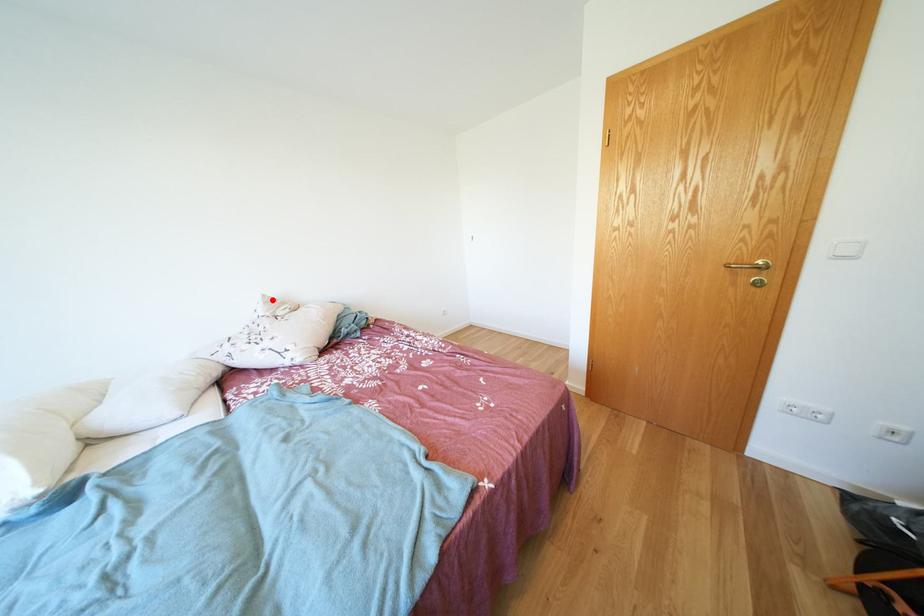
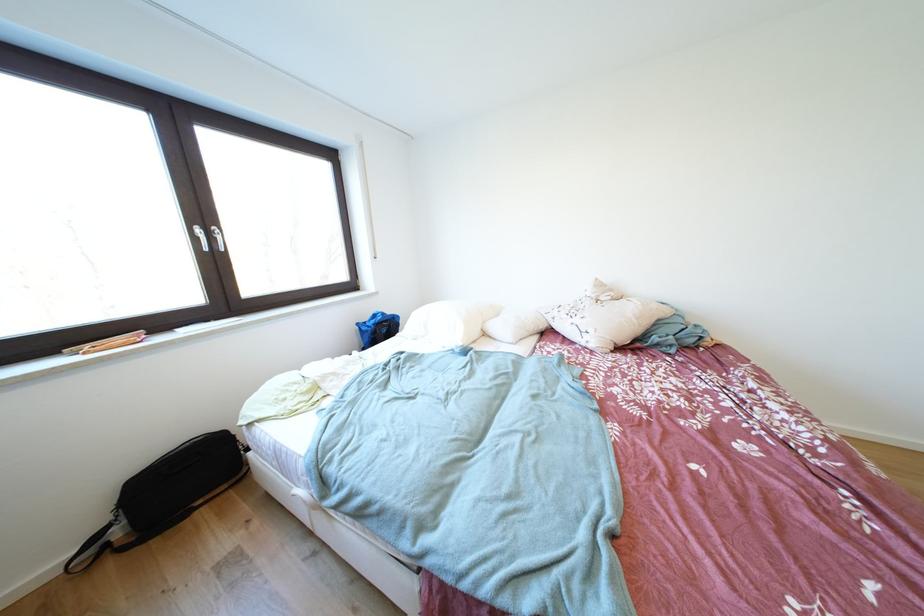
Where in the second image is the point corresponding to the highlighted location from the first image?

(604, 284)